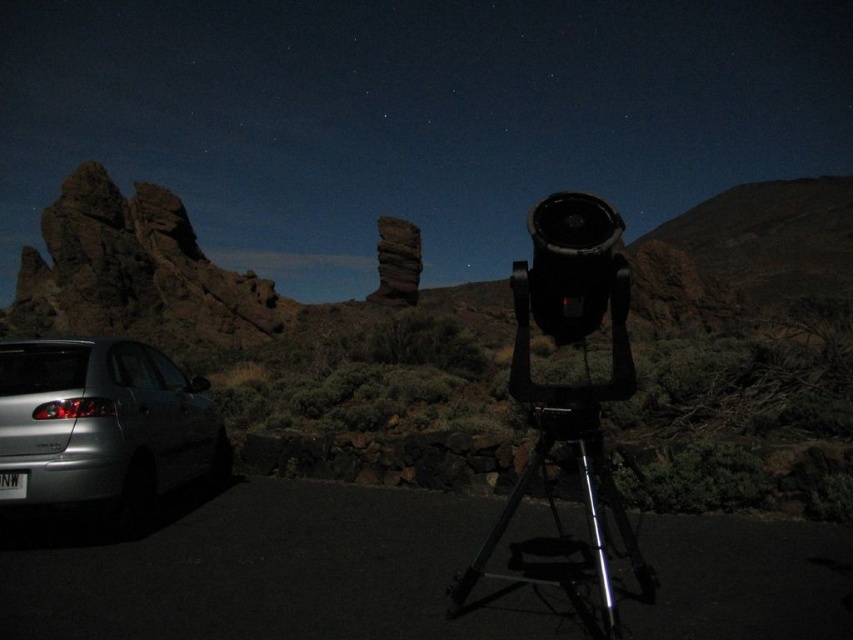
Question: Estimate the real-world distances between objects in this image. Which object is closer to the dark brown rocky outcrop at left?

Choices:
 (A) silver metallic car at lower left
 (B) silver metallic tripod at center

Answer: (A)

Question: In this image, where is silver metallic car at lower left located relative to silver metallic tripod at center?

Choices:
 (A) above
 (B) below

Answer: (B)

Question: Which is nearer to the silver metallic tripod at center?

Choices:
 (A) dark brown rocky outcrop at left
 (B) silver metallic car at lower left

Answer: (B)

Question: Does dark brown rocky outcrop at left have a larger size compared to silver metallic tripod at center?

Choices:
 (A) no
 (B) yes

Answer: (B)

Question: Which of the following is the farthest from the observer?

Choices:
 (A) dark brown rocky outcrop at left
 (B) silver metallic tripod at center
 (C) silver metallic car at lower left

Answer: (A)

Question: Does silver metallic car at lower left lie in front of silver metallic tripod at center?

Choices:
 (A) no
 (B) yes

Answer: (A)